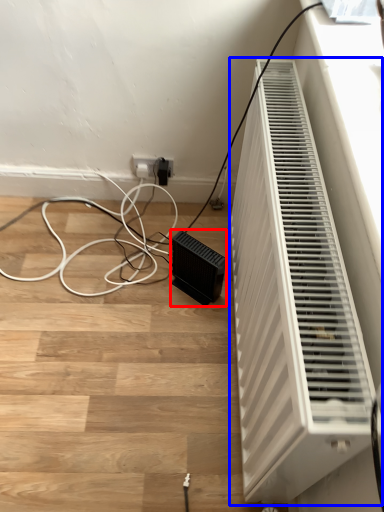
Question: Which of the following is the closest to the observer, speaker (highlighted by a red box) or home appliance (highlighted by a blue box)?

Choices:
 (A) speaker
 (B) home appliance

Answer: (B)